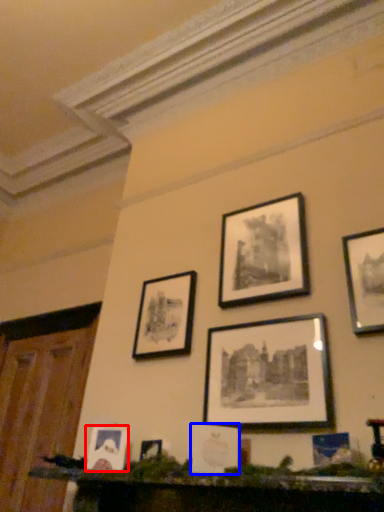
Question: Which object is closer to the camera taking this photo, picture frame (highlighted by a red box) or picture frame (highlighted by a blue box)?

Choices:
 (A) picture frame
 (B) picture frame

Answer: (B)